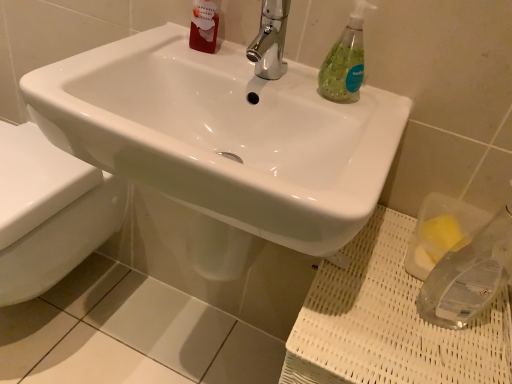
I want to click on vacant area that lies between chrome metallic faucet at upper center and green translucent soap dispenser at upper right, so click(x=300, y=91).